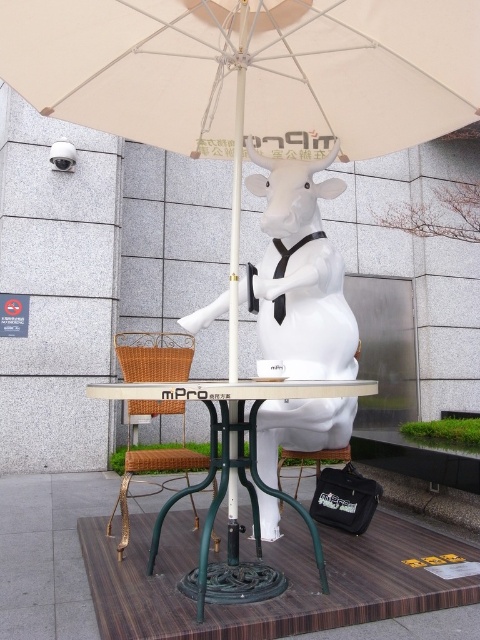
You are a delivery person who needs to place a large box on the table in the image. The box is taller than the statue. Can you place the box on the green metal table at center without it touching the white glossy statue at center?

The white glossy statue at center is much taller than the green metal table at center. Since the box is taller than the statue, it would definitely be taller than the table, so placing the box on the green metal table at center would cause it to touch or exceed the table height, making it unstable and likely to fall over.

You are a visitor at this quirky outdoor area and want to sit on the woven rattan stool at lower center. However, there is a white glossy statue at center nearby. Which side of the stool should you approach from to avoid the statue?

The white glossy statue at center is to the right of the woven rattan stool at lower center, so you should approach from the left side of the stool to avoid the statue.